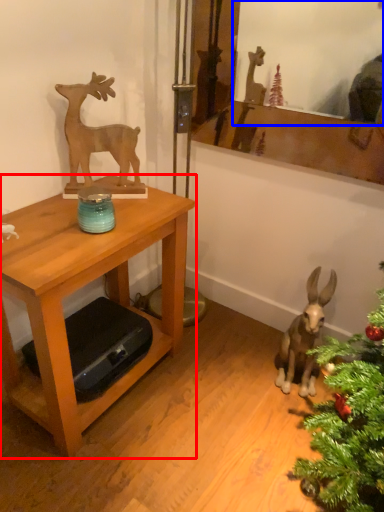
Question: Among these objects, which one is farthest to the camera, table (highlighted by a red box) or mirror (highlighted by a blue box)?

Choices:
 (A) table
 (B) mirror

Answer: (B)